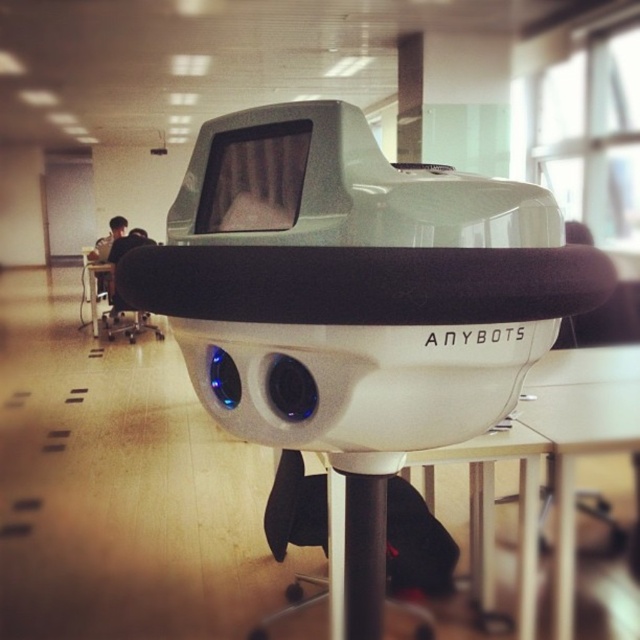
You are a student who needs to sit down at a desk. You see the white matte anybots at center and the matte black chair at left. Which object should you sit on?

The matte black chair at left is the appropriate object to sit on, as chairs are designed for seating. The white matte anybots at center appears to be a robotic device or VR headset and is not meant for sitting.

You are organizing a classroom and need to place the white matte anybots at center and the matte black chair at left in a small corner. Which object should you place first to maximize space efficiency?

You should place the matte black chair at left first because the white matte anybots at center occupies less space, so it can be placed in the remaining space after positioning the larger matte black chair at left.

You are setting up a classroom and need to arrange the white matte anybots at center and the matte black chair at left. If the desk space is limited, which object should you prioritize moving to save more space?

The white matte anybots at center has a smaller width than the matte black chair at left, so you should prioritize moving the matte black chair at left to save more space since it occupies more space.